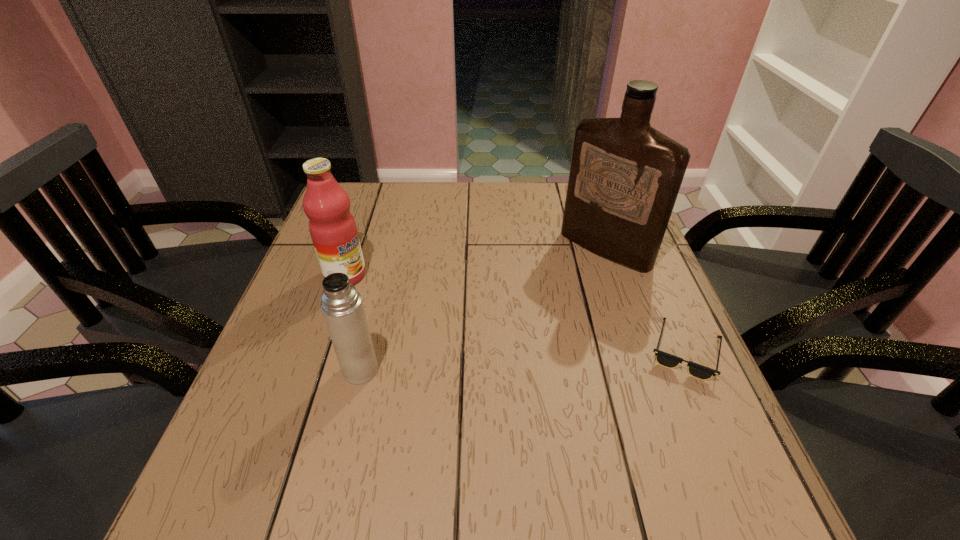
The height and width of the screenshot is (540, 960). I want to click on free spot located on the label side of the tallest object, so click(552, 296).

Where is `free space located 0.190m on the label of the fruit juice`? Image resolution: width=960 pixels, height=540 pixels. free space located 0.190m on the label of the fruit juice is located at coordinates (416, 319).

Locate an element on the screen. Image resolution: width=960 pixels, height=540 pixels. vacant area situated 0.160m on the label of the fruit juice is located at coordinates (406, 313).

You are a GUI agent. You are given a task and a screenshot of the screen. Output one action in this format:
    pyautogui.click(x=<x>, y=<y>)
    Task: Click on the vacant space positioned 0.290m on the label of the fruit juice
    Image resolution: width=960 pixels, height=540 pixels.
    Given the screenshot: What is the action you would take?
    pyautogui.click(x=449, y=340)

I want to click on object located in the left edge section of the desktop, so click(x=332, y=227).

Locate an element on the screen. This screenshot has height=540, width=960. sunglasses that is at the right edge is located at coordinates (665, 359).

Locate an element on the screen. The height and width of the screenshot is (540, 960). liquor that is positioned at the right edge is located at coordinates (625, 176).

Find the location of a particular element. This screenshot has height=540, width=960. free region at the far edge of the desktop is located at coordinates (x=508, y=208).

This screenshot has height=540, width=960. In the image, there is a desktop. Find the location of `vacant space at the near edge`. vacant space at the near edge is located at coordinates (574, 449).

Where is `vacant area at the left edge`? This screenshot has height=540, width=960. vacant area at the left edge is located at coordinates (321, 367).